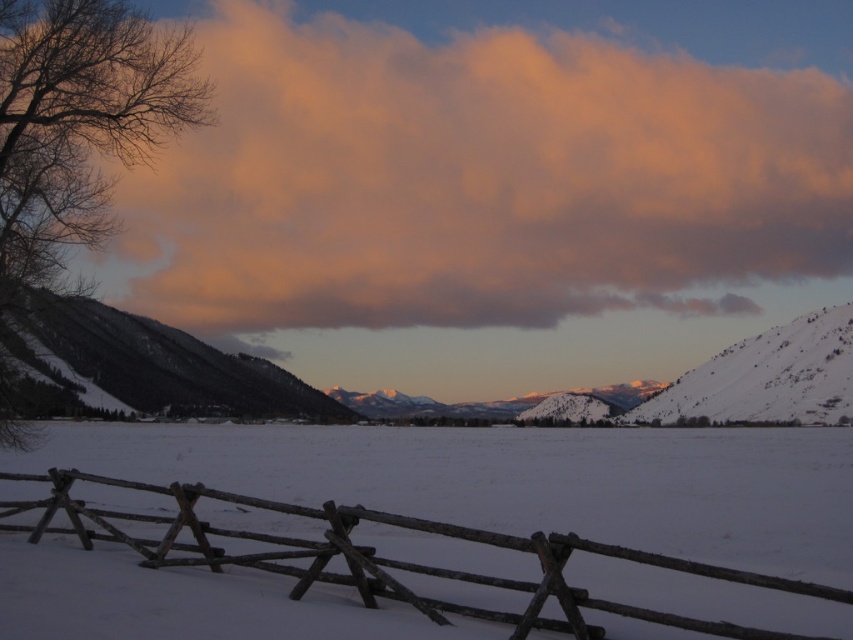
You are an artist planning to sketch this winter scene. You want to ensure the brown wooden fence at lower center and the snowy textured mountain at left are proportionally accurate. Which object should you draw with a narrower width in your sketch?

The brown wooden fence at lower center should be drawn with a narrower width since it is thinner than the snowy textured mountain at left according to the description.